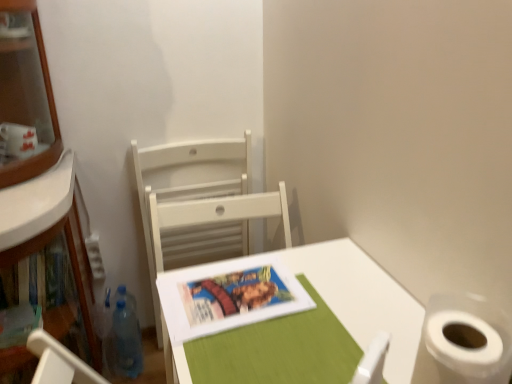
Where is `spots to the right of matte paper book cover at center`? spots to the right of matte paper book cover at center is located at coordinates (342, 298).